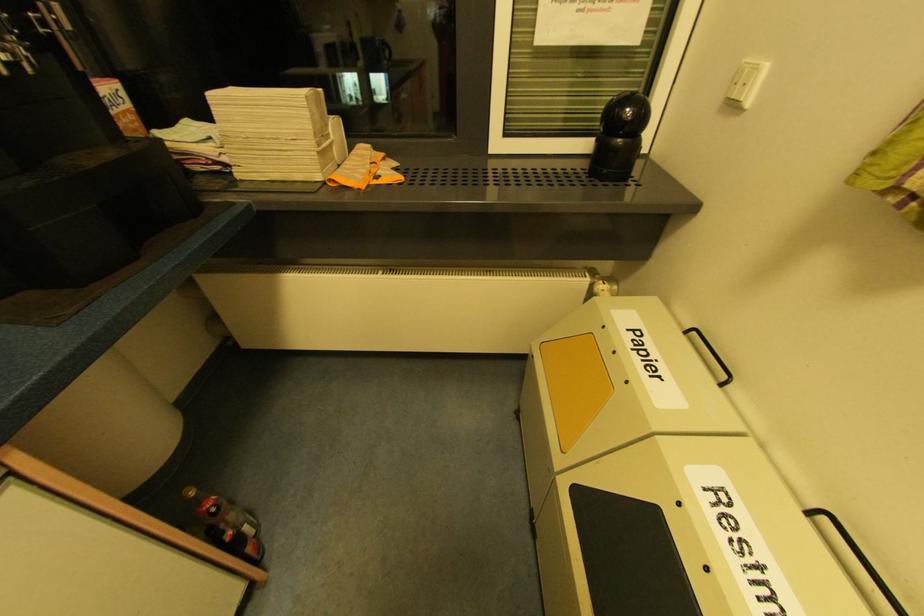
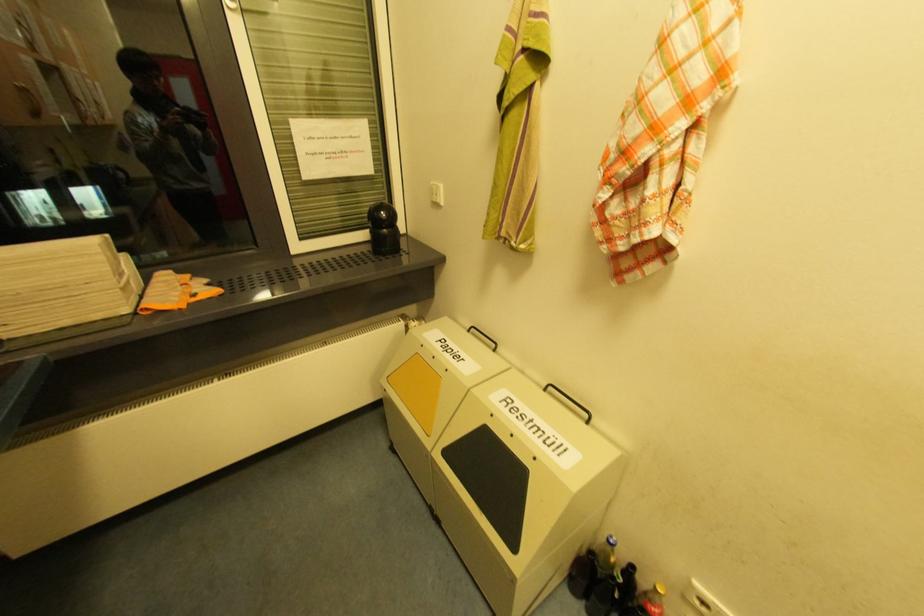
Find the pixel in the second image that matches (623,140) in the first image.

(388, 230)